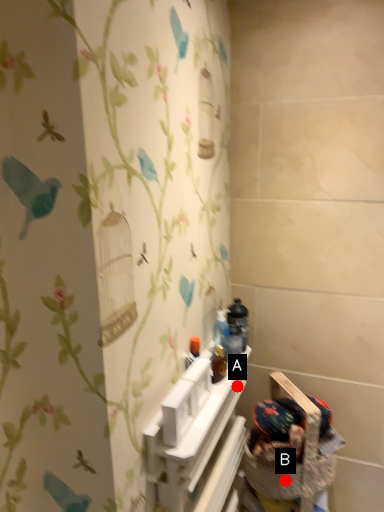
Question: Two points are circled on the image, labeled by A and B beside each circle. Which point is farther to the camera?

Choices:
 (A) A is further
 (B) B is further

Answer: (A)